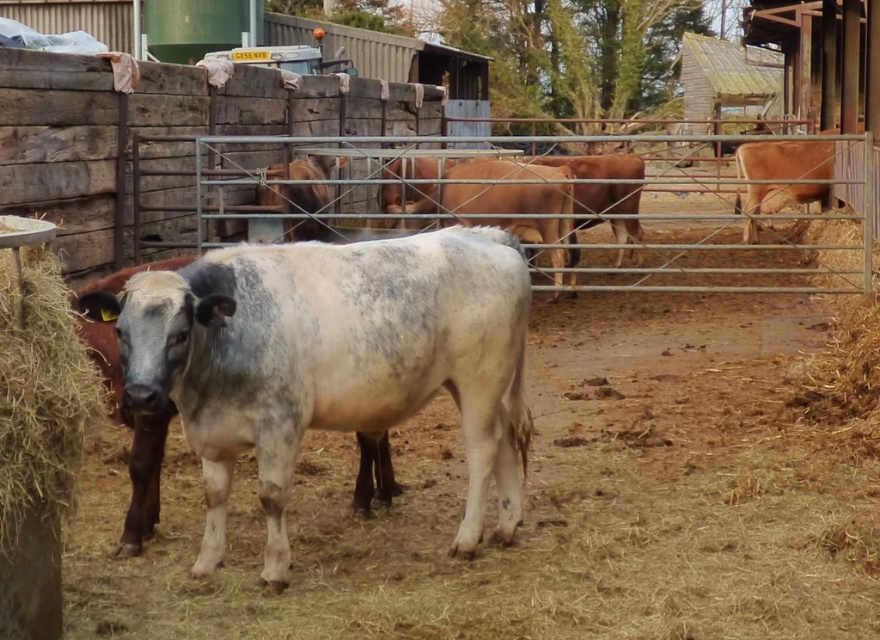
You are a farmer checking the fence. You notice the brown straw at left and the brown matte cow at right. Which object is wider?

The brown matte cow at right is wider than the brown straw at left.

You are standing at the front of the farm enclosure and see two points marked on the ground. The first point is at position point [224,424] and the second point is at position point [41,508]. Which point is closer to you?

Point [41,508] is closer to you because it is in front of point [224,424].

You are a farmer who needs to place a new feeding trough between the brown straw at left and the brown matte cow at right. Based on their positions, where should the trough be placed?

The brown straw at left is to the left of the brown matte cow at right, so the feeding trough should be placed between them, to the right of the brown straw at left and to the left of the brown matte cow at right.